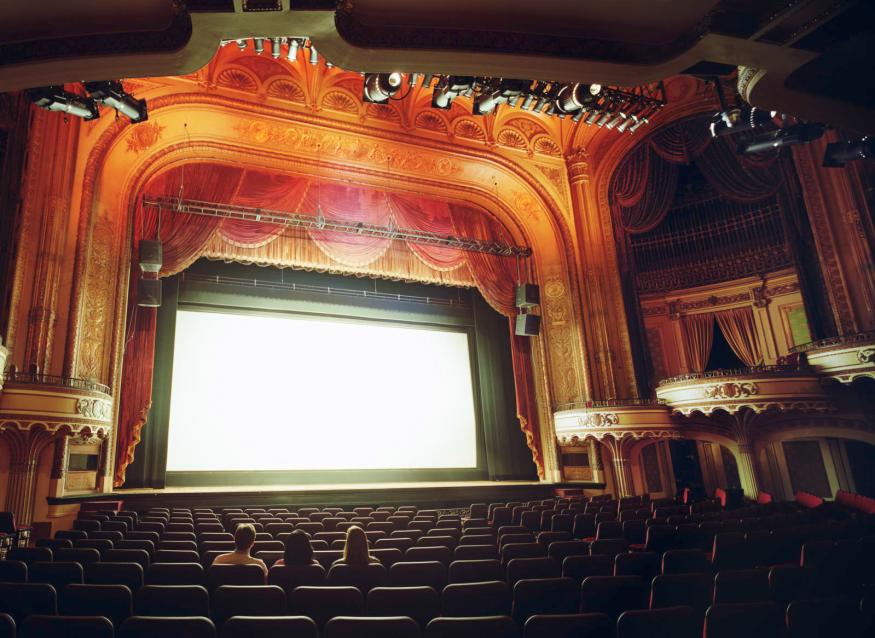
Where is `lights`? This screenshot has height=638, width=875. lights is located at coordinates (156, 265), (154, 293), (523, 332), (530, 300).